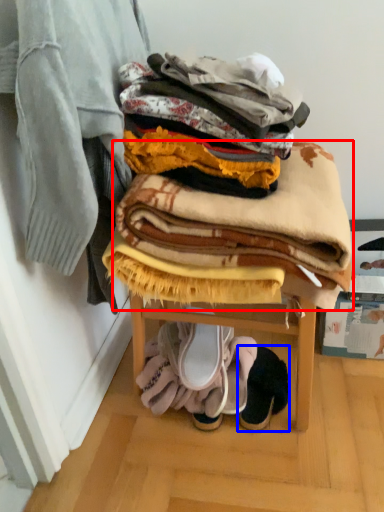
Question: Which object appears closest to the camera in this image, blanket (highlighted by a red box) or footwear (highlighted by a blue box)?

Choices:
 (A) blanket
 (B) footwear

Answer: (A)